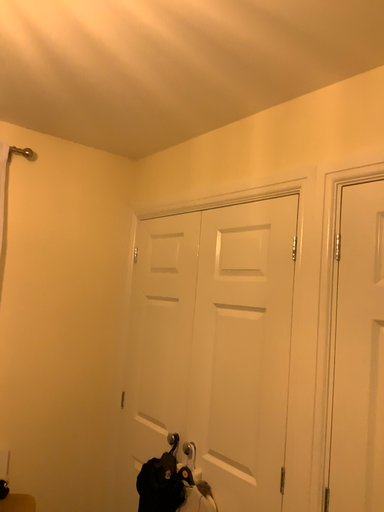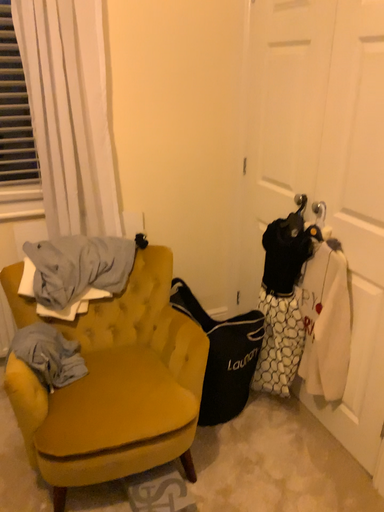
Question: How did the camera likely rotate when shooting the video?

Choices:
 (A) rotated left
 (B) rotated right

Answer: (A)